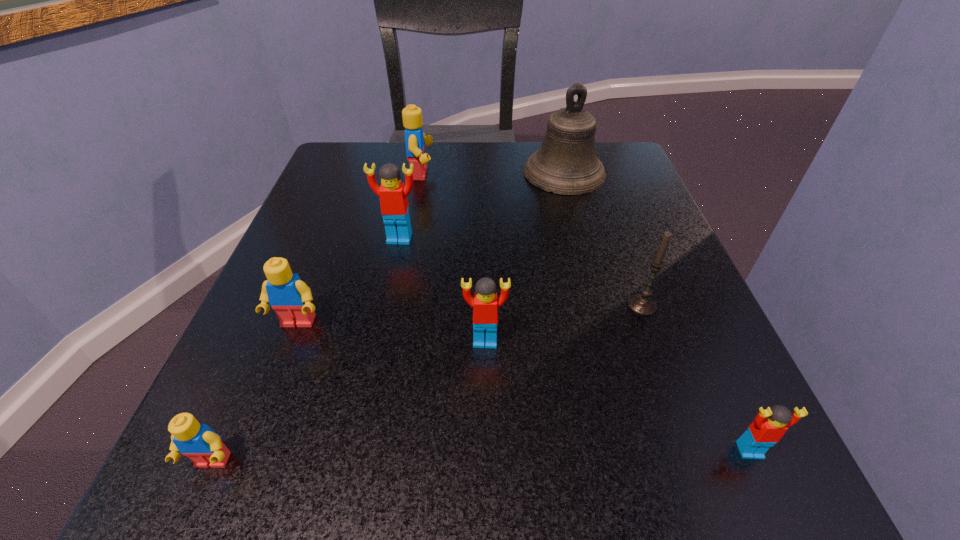
At what (x,y) coordinates should I click in order to perform the action: click on bell. Please return your answer as a coordinate pair (x, y). The width and height of the screenshot is (960, 540). Looking at the image, I should click on (566, 163).

The width and height of the screenshot is (960, 540). I want to click on the farthest red Lego, so click(x=393, y=194).

Identify the location of the third farthest object. (393, 194).

Image resolution: width=960 pixels, height=540 pixels. Identify the location of the farthest Lego. (415, 140).

This screenshot has width=960, height=540. I want to click on the farthest yellow Lego, so click(x=415, y=140).

This screenshot has height=540, width=960. Find the location of `candle`. candle is located at coordinates (643, 304).

Find the location of a particular element. Image resolution: width=960 pixels, height=540 pixels. the second biggest red Lego is located at coordinates (485, 304).

At what (x,y) coordinates should I click in order to perform the action: click on the second nearest red Lego. Please return your answer as a coordinate pair (x, y). This screenshot has width=960, height=540. Looking at the image, I should click on (485, 304).

You are a GUI agent. You are given a task and a screenshot of the screen. Output one action in this format:
    pyautogui.click(x=<x>, y=<y>)
    Task: Click on the second biggest yellow Lego
    The width and height of the screenshot is (960, 540).
    Given the screenshot: What is the action you would take?
    pyautogui.click(x=287, y=294)

Locate an element on the screen. The height and width of the screenshot is (540, 960). the smallest red Lego is located at coordinates (769, 425).